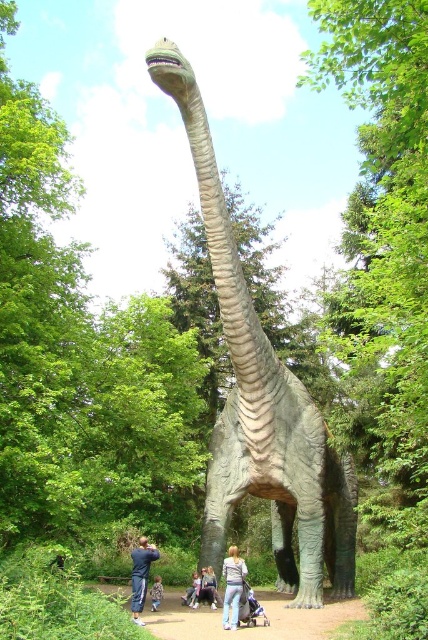
Question: In this image, where is green textured dinosaur at center located relative to light brown fabric pants at lower center?

Choices:
 (A) above
 (B) below

Answer: (A)

Question: Does denim pants at lower center appear under blue fabric baby carriage at lower center?

Choices:
 (A) no
 (B) yes

Answer: (A)

Question: Among these objects, which one is nearest to the camera?

Choices:
 (A) light gray fabric pants at lower center
 (B) light blue jeans at lower center

Answer: (A)

Question: Is denim pants at lower center positioned behind blue jeans at lower center?

Choices:
 (A) yes
 (B) no

Answer: (A)

Question: Which of these objects is positioned closest to the blue fabric baby carriage at lower center?

Choices:
 (A) light brown fabric pants at lower center
 (B) light blue jeans at lower center
 (C) green textured dinosaur at center
 (D) blue jeans at lower center

Answer: (B)

Question: Estimate the real-world distances between objects in this image. Which object is closer to the green textured dinosaur at center?

Choices:
 (A) light gray fabric pants at lower center
 (B) light brown fabric pants at lower center

Answer: (A)